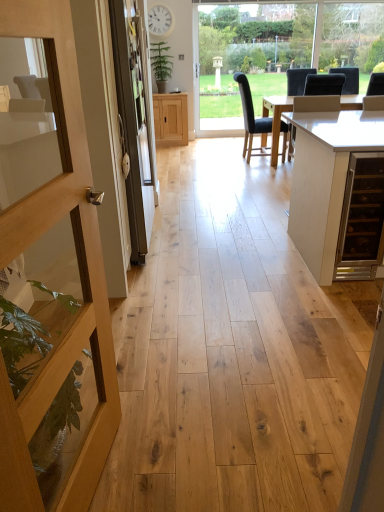
Question: From the image's perspective, is clear glass screen door at left beneath transparent glass window at center?

Choices:
 (A) yes
 (B) no

Answer: (A)

Question: Does clear glass screen door at left have a larger size compared to transparent glass window at center?

Choices:
 (A) yes
 (B) no

Answer: (A)

Question: Does clear glass screen door at left have a lesser width compared to transparent glass window at center?

Choices:
 (A) no
 (B) yes

Answer: (A)

Question: Is clear glass screen door at left in contact with transparent glass window at center?

Choices:
 (A) no
 (B) yes

Answer: (A)

Question: Is clear glass screen door at left at the left side of transparent glass window at center?

Choices:
 (A) yes
 (B) no

Answer: (A)

Question: Is black leather chair at center, positioned as the 2th chair in right-to-left order, wider or thinner than green leafy plant at upper center?

Choices:
 (A) thin
 (B) wide

Answer: (B)

Question: In the image, is black leather chair at center, positioned as the 2th chair in right-to-left order, on the left side or the right side of green leafy plant at upper center?

Choices:
 (A) right
 (B) left

Answer: (A)

Question: From a real-world perspective, is black leather chair at center, the first chair viewed from the left, positioned above or below green leafy plant at upper center?

Choices:
 (A) above
 (B) below

Answer: (B)

Question: Considering their positions, is black leather chair at center, positioned as the 2th chair in right-to-left order, located in front of or behind green leafy plant at upper center?

Choices:
 (A) behind
 (B) front

Answer: (B)

Question: Is transparent glass window at center to the left or to the right of dark gray fabric chair at center, placed as the second chair when sorted from left to right, in the image?

Choices:
 (A) right
 (B) left

Answer: (B)

Question: Is transparent glass window at center inside the boundaries of dark gray fabric chair at center, placed as the second chair when sorted from left to right, or outside?

Choices:
 (A) outside
 (B) inside

Answer: (A)

Question: Is transparent glass window at center in front of or behind dark gray fabric chair at center, the 1th chair in the right-to-left sequence, in the image?

Choices:
 (A) behind
 (B) front

Answer: (A)

Question: From their relative heights in the image, would you say transparent glass window at center is taller or shorter than dark gray fabric chair at center, the 1th chair in the right-to-left sequence?

Choices:
 (A) short
 (B) tall

Answer: (B)

Question: Considering the positions of green leafy plant at upper center and light brown wood cabinet at center in the image, is green leafy plant at upper center bigger or smaller than light brown wood cabinet at center?

Choices:
 (A) small
 (B) big

Answer: (A)

Question: Is green leafy plant at upper center situated inside light brown wood cabinet at center or outside?

Choices:
 (A) inside
 (B) outside

Answer: (B)